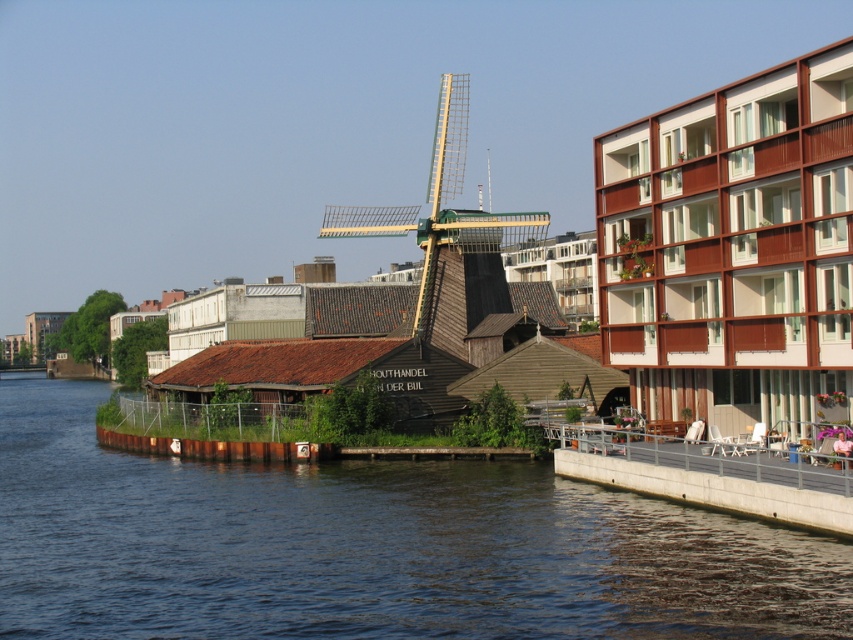
You are a boat captain approaching the riverside area shown in the image. You need to dock your boat at the concrete gray dock at lower right. Based on the scene description, will the dark blue water at lower left provide enough depth for your boat to safely reach the dock?

The dark blue water at lower left is much taller than the concrete gray dock at lower right, which indicates that the water depth is sufficient for the boat to safely reach the dock.

You are standing at the center of the image and want to walk to the concrete gray dock at lower right. In which direction should you move relative to the windmill?

You should move to the right relative to the windmill to reach the concrete gray dock at lower right.